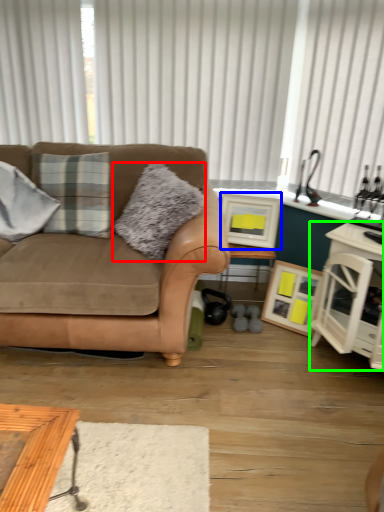
Question: Considering the real-world distances, which object is closest to pillow (highlighted by a red box)? picture frame (highlighted by a blue box) or cabinetry (highlighted by a green box).

Choices:
 (A) picture frame
 (B) cabinetry

Answer: (A)